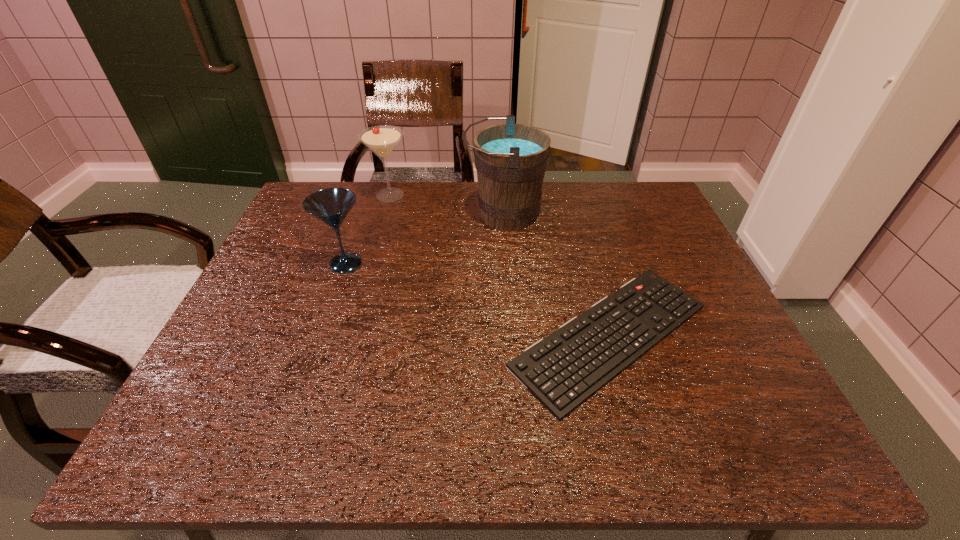
I want to click on vacant area that lies between the nearer martini and the computer keyboard, so click(478, 300).

You are a GUI agent. You are given a task and a screenshot of the screen. Output one action in this format:
    pyautogui.click(x=<x>, y=<y>)
    Task: Click on the empty space between the computer keyboard and the nearer martini
    This screenshot has height=540, width=960.
    Given the screenshot: What is the action you would take?
    pyautogui.click(x=478, y=300)

This screenshot has width=960, height=540. What are the coordinates of `object that stands as the closest to the farther martini` in the screenshot? It's located at (511, 159).

Identify which object is located as the nearest to the farther martini. Please provide its 2D coordinates. Your answer should be formatted as a tuple, i.e. [(x, y)], where the tuple contains the x and y coordinates of a point satisfying the conditions above.

[(511, 159)]

This screenshot has height=540, width=960. Identify the location of free space in the image that satisfies the following two spatial constraints: 1. on the back side of the shortest object; 2. with a handle on the side of the tallest object. (576, 215).

This screenshot has height=540, width=960. Find the location of `free spot that satisfies the following two spatial constraints: 1. on the front side of the shortest object; 2. on the right side of the farther martini`. free spot that satisfies the following two spatial constraints: 1. on the front side of the shortest object; 2. on the right side of the farther martini is located at coordinates (350, 336).

Find the location of a particular element. Image resolution: width=960 pixels, height=540 pixels. vacant space that satisfies the following two spatial constraints: 1. on the back side of the shortest object; 2. with a handle on the side of the tallest object is located at coordinates (576, 215).

Identify the location of vacant region that satisfies the following two spatial constraints: 1. with a handle on the side of the wine bucket; 2. on the left side of the shortest object. This screenshot has height=540, width=960. (513, 336).